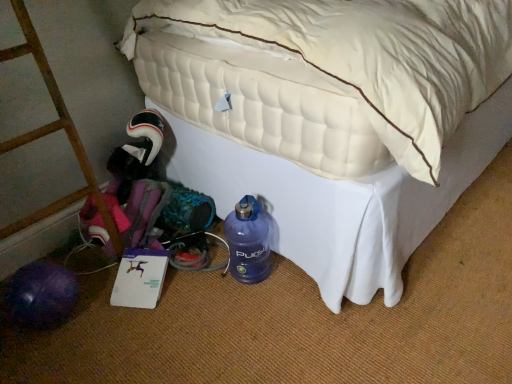
Question: Is white quilted mattress at lower left inside the boundaries of blue matte water bottle at lower center, or outside?

Choices:
 (A) inside
 (B) outside

Answer: (B)

Question: Considering the positions of white quilted mattress at lower left and blue matte water bottle at lower center in the image, is white quilted mattress at lower left bigger or smaller than blue matte water bottle at lower center?

Choices:
 (A) small
 (B) big

Answer: (B)

Question: Estimate the real-world distances between objects in this image. Which object is farther from the white quilted mattress at lower left?

Choices:
 (A) brushed metal ladder at left
 (B) blue matte water bottle at lower center

Answer: (A)

Question: Estimate the real-world distances between objects in this image. Which object is farther from the brushed metal ladder at left?

Choices:
 (A) blue matte water bottle at lower center
 (B) white quilted mattress at lower left

Answer: (B)